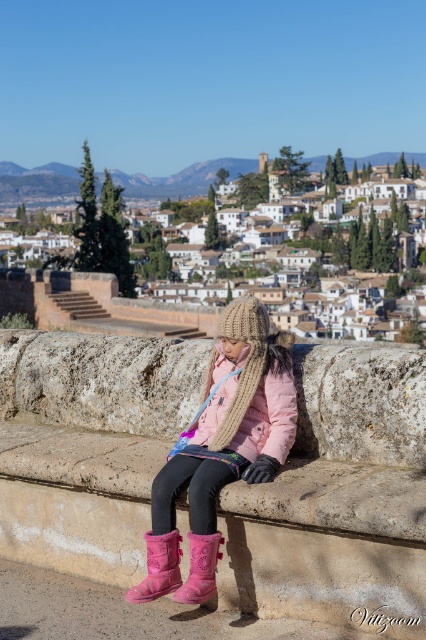
Between pink suede boots at center and pink suede boot at lower center, which one has more height?

With more height is pink suede boots at center.

Does pink suede boots at center lie behind pink suede boot at lower center?

Yes, it is.

Is point (279, 401) positioned after point (207, 548)?

Yes, it is.

This screenshot has height=640, width=426. Identify the location of pink suede boots at center. (221, 449).

Does stone ledge at center have a greater width compared to pink suede boot at lower center?

Yes, stone ledge at center is wider than pink suede boot at lower center.

Is stone ledge at center smaller than pink suede boot at lower center?

No.

Which is in front, point (68, 497) or point (198, 573)?

Point (198, 573)

This screenshot has width=426, height=640. I want to click on stone ledge at center, so click(x=339, y=500).

Does pink suede boots at center have a smaller size compared to pink suede boot at lower left?

No, pink suede boots at center is not smaller than pink suede boot at lower left.

The image size is (426, 640). I want to click on pink suede boots at center, so click(x=221, y=449).